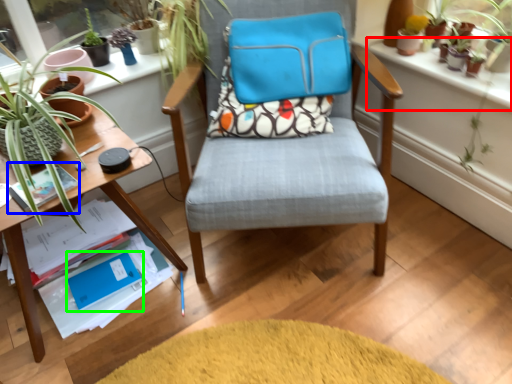
Question: Which is nearer to the window sill (highlighted by a red box)? paperback book (highlighted by a blue box) or paperback book (highlighted by a green box).

Choices:
 (A) paperback book
 (B) paperback book

Answer: (A)